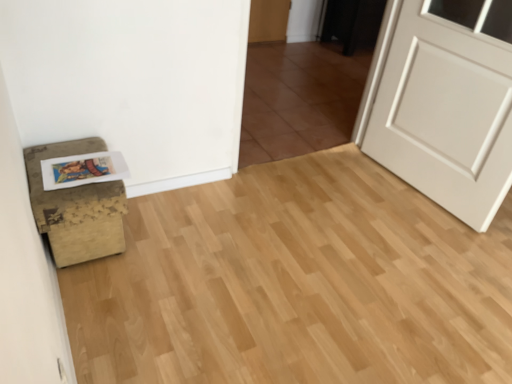
Based on the photo, what is the approximate width of matte paper postcard at lower left?

12.15 inches.

Measure the distance between point (448, 47) and camera.

Point (448, 47) and camera are 6.42 feet apart.

Find the location of a particular element. The height and width of the screenshot is (384, 512). white matte door at right is located at coordinates (445, 103).

You are a GUI agent. You are given a task and a screenshot of the screen. Output one action in this format:
    pyautogui.click(x=<x>, y=<y>)
    Task: Click on the matte paper postcard at lower left
    
    Given the screenshot: What is the action you would take?
    pyautogui.click(x=83, y=170)

Is white matte door at right in front of matte paper postcard at lower left?

Yes.

Considering the points (483, 31) and (44, 172), which point is behind, point (483, 31) or point (44, 172)?

Point (483, 31)

Would you say white matte door at right is outside matte paper postcard at lower left?

Indeed, white matte door at right is completely outside matte paper postcard at lower left.

Is white matte door at right aimed at matte paper postcard at lower left?

Yes, white matte door at right faces towards matte paper postcard at lower left.

Is matte paper postcard at lower left next to brown tile at center and touching it?

matte paper postcard at lower left and brown tile at center are not in contact.

In the image, there is a brown tile at center. Where is `postcard below it (from a real-world perspective)`? postcard below it (from a real-world perspective) is located at coordinates (83, 170).

From the image's perspective, relative to brown tile at center, is matte paper postcard at lower left above or below?

Based on their image positions, matte paper postcard at lower left is located beneath brown tile at center.

Is point (104, 170) closer to viewer compared to point (341, 95)?

Yes, it is.

At what (x,y) coordinates should I click in order to perform the action: click on furniture in front of the matte paper postcard at lower left. Please return your answer as a coordinate pair (x, y). The width and height of the screenshot is (512, 384). Looking at the image, I should click on (76, 207).

How many degrees apart are the facing directions of distressed brown ottoman at lower left and matte paper postcard at lower left?

The facing directions of distressed brown ottoman at lower left and matte paper postcard at lower left are 2.48 degrees apart.

From the picture: Would you say distressed brown ottoman at lower left contains matte paper postcard at lower left?

Indeed, matte paper postcard at lower left is located within distressed brown ottoman at lower left.

From a real-world perspective, between distressed brown ottoman at lower left and matte paper postcard at lower left, who is vertically higher?

matte paper postcard at lower left, from a real-world perspective.

Looking at this image, is brown tile at center closer to camera compared to distressed brown ottoman at lower left?

No, brown tile at center is further to the viewer.

From the image's perspective, which is above, brown tile at center or distressed brown ottoman at lower left?

brown tile at center.

Considering the positions of objects brown tile at center and distressed brown ottoman at lower left in the image provided, who is more to the left, brown tile at center or distressed brown ottoman at lower left?

Positioned to the left is distressed brown ottoman at lower left.

Which of these two, brown tile at center or distressed brown ottoman at lower left, stands taller?

With more height is brown tile at center.

Is white matte door at right taller or shorter than brown tile at center?

Clearly, white matte door at right is taller compared to brown tile at center.

From the image's perspective, is white matte door at right positioned above or below brown tile at center?

Clearly, from the image's perspective, white matte door at right is below brown tile at center.

Considering the relative positions of white matte door at right and brown tile at center in the image provided, is white matte door at right to the left of brown tile at center from the viewer's perspective?

In fact, white matte door at right is to the right of brown tile at center.

From a real-world perspective, is white matte door at right located higher than distressed brown ottoman at lower left?

Correct, in the physical world, white matte door at right is higher than distressed brown ottoman at lower left.

Is point (426, 23) less distant than point (67, 254)?

No, (426, 23) is behind (67, 254).

Is white matte door at right oriented away from distressed brown ottoman at lower left?

No, white matte door at right's orientation is not away from distressed brown ottoman at lower left.

Would you say distressed brown ottoman at lower left contains brown tile at center?

Definitely not — brown tile at center is not inside distressed brown ottoman at lower left.

From the image's perspective, who appears lower, distressed brown ottoman at lower left or brown tile at center?

distressed brown ottoman at lower left appears lower in the image.

Is point (31, 202) farther from camera compared to point (311, 91)?

No, (31, 202) is in front of (311, 91).

Is distressed brown ottoman at lower left bigger than brown tile at center?

No, distressed brown ottoman at lower left is not bigger than brown tile at center.

Locate an element on the screen. The width and height of the screenshot is (512, 384). postcard beneath the white matte door at right (from a real-world perspective) is located at coordinates coord(83,170).

Find the location of a particular element. tile lying behind the matte paper postcard at lower left is located at coordinates (298, 99).

Considering their positions, is white matte door at right positioned closer to distressed brown ottoman at lower left than brown tile at center?

brown tile at center is closer to distressed brown ottoman at lower left.

Looking at the image, which one is located further to white matte door at right, matte paper postcard at lower left or brown tile at center?

matte paper postcard at lower left.

Which object lies further to the anchor point distressed brown ottoman at lower left, white matte door at right or matte paper postcard at lower left?

white matte door at right lies further to distressed brown ottoman at lower left than the other object.

Which object lies further to the anchor point matte paper postcard at lower left, brown tile at center or white matte door at right?

The object further to matte paper postcard at lower left is brown tile at center.

Which object lies nearer to the anchor point brown tile at center, matte paper postcard at lower left or white matte door at right?

white matte door at right is positioned closer to the anchor brown tile at center.

From the image, which object appears to be farther from brown tile at center, distressed brown ottoman at lower left or matte paper postcard at lower left?

matte paper postcard at lower left.

Based on their spatial positions, is distressed brown ottoman at lower left or brown tile at center further from white matte door at right?

Based on the image, distressed brown ottoman at lower left appears to be further to white matte door at right.

Estimate the real-world distances between objects in this image. Which object is closer to white matte door at right, matte paper postcard at lower left or distressed brown ottoman at lower left?

The object closer to white matte door at right is matte paper postcard at lower left.

Identify the location of tile between matte paper postcard at lower left and white matte door at right in the horizontal direction. (298, 99).

Locate an element on the screen. postcard between distressed brown ottoman at lower left and white matte door at right from left to right is located at coordinates (83, 170).

The width and height of the screenshot is (512, 384). I want to click on tile situated between distressed brown ottoman at lower left and white matte door at right from left to right, so click(x=298, y=99).

Locate an element on the screen. postcard situated between distressed brown ottoman at lower left and brown tile at center from left to right is located at coordinates (83, 170).